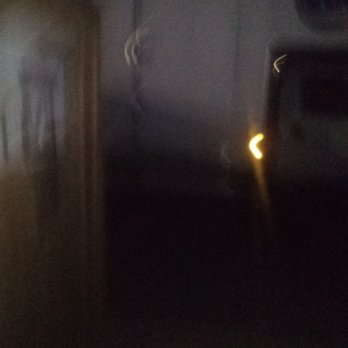
Identify the location of grey wall. The height and width of the screenshot is (348, 348). (193, 62).